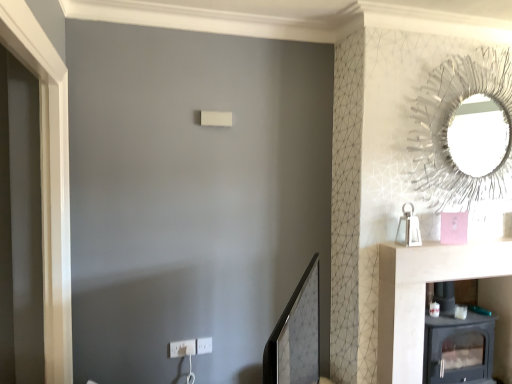
You are a GUI agent. You are given a task and a screenshot of the screen. Output one action in this format:
    pyautogui.click(x=<x>, y=<y>)
    Task: Click on the black matte wood stove at lower right
    The width and height of the screenshot is (512, 384).
    Given the screenshot: What is the action you would take?
    pyautogui.click(x=423, y=295)

Where is `white plastic electric outlet at lower center, marked as the first electric outlet in a left-to-right arrangement`? This screenshot has width=512, height=384. white plastic electric outlet at lower center, marked as the first electric outlet in a left-to-right arrangement is located at coordinates point(182,348).

Based on the photo, which of these two, metallic wire at upper right, positioned as the 2th mirror in bottom-to-top order, or black matte wood stove at lower right, is thinner?

metallic wire at upper right, positioned as the 2th mirror in bottom-to-top order.

Consider the image. Does metallic wire at upper right, which appears as the 1th mirror when viewed from the back, have a lesser height compared to black matte wood stove at lower right?

Incorrect, the height of metallic wire at upper right, which appears as the 1th mirror when viewed from the back, does not fall short of that of black matte wood stove at lower right.

Are metallic wire at upper right, placed as the second mirror when sorted from front to back, and black matte wood stove at lower right making contact?

metallic wire at upper right, placed as the second mirror when sorted from front to back, and black matte wood stove at lower right are clearly separated.

Considering the sizes of white plastic electric outlet at lower center, marked as the first electric outlet in a left-to-right arrangement, and black matte wood stove at lower right in the image, is white plastic electric outlet at lower center, marked as the first electric outlet in a left-to-right arrangement, wider or thinner than black matte wood stove at lower right?

Considering their sizes, white plastic electric outlet at lower center, marked as the first electric outlet in a left-to-right arrangement, looks slimmer than black matte wood stove at lower right.

Is white plastic electric outlet at lower center, marked as the first electric outlet in a left-to-right arrangement, beside black matte wood stove at lower right?

No, white plastic electric outlet at lower center, marked as the first electric outlet in a left-to-right arrangement, is not making contact with black matte wood stove at lower right.

From a real-world perspective, which object stands above the other?

From a 3D spatial view, white plastic electric outlet at lower center, which is counted as the 2th electric outlet, starting from the right, is above.

How different are the orientations of white plastic electric outlet at lower center, marked as the first electric outlet in a left-to-right arrangement, and black matte wood stove at lower right in degrees?

They differ by 0.128 degrees in their facing directions.

Starting from the white plastic electric outlet at lower center, marked as the first electric outlet in a left-to-right arrangement, which mirror is the 1st one to the right? Please provide its 2D coordinates.

[(296, 335)]

Could you tell me if white plastic electric outlet at lower center, which is counted as the 2th electric outlet, starting from the right, is facing matte black mirror at center, the second mirror viewed from the right?

Yes, white plastic electric outlet at lower center, which is counted as the 2th electric outlet, starting from the right, faces towards matte black mirror at center, the second mirror viewed from the right.

Between white plastic electric outlet at lower center, which is counted as the 2th electric outlet, starting from the right, and matte black mirror at center, the 2th mirror viewed from the back, which one has larger size?

Bigger between the two is matte black mirror at center, the 2th mirror viewed from the back.

Between white plastic electric outlet at lower center, marked as the first electric outlet in a left-to-right arrangement, and matte black mirror at center, the 2th mirror viewed from the back, which one has less height?

white plastic electric outlet at lower center, marked as the first electric outlet in a left-to-right arrangement, is shorter.

Is white plastic electric outlet at lower center, acting as the 2th electric outlet starting from the left, at the left side of metallic wire at upper right, the 1th mirror in the right-to-left sequence?

Yes.

Identify the location of the 2nd mirror to the right of the white plastic electric outlet at lower center, acting as the 2th electric outlet starting from the left, counting from the anchor's position. (464, 130).

Between white plastic electric outlet at lower center, which is the 1th electric outlet in right-to-left order, and metallic wire at upper right, the 1th mirror in the right-to-left sequence, which one has more height?

metallic wire at upper right, the 1th mirror in the right-to-left sequence.

Is point (269, 381) closer or farther from the camera than point (487, 259)?

Clearly, point (269, 381) is closer to the camera than point (487, 259).

Which object is positioned more to the right, matte black mirror at center, the 2th mirror viewed from the back, or black matte wood stove at lower right?

From the viewer's perspective, black matte wood stove at lower right appears more on the right side.

From the image's perspective, is matte black mirror at center, which ranks as the 2th mirror in top-to-bottom order, beneath black matte wood stove at lower right?

No, from the image's perspective, matte black mirror at center, which ranks as the 2th mirror in top-to-bottom order, is not below black matte wood stove at lower right.

In the scene shown: Considering the positions of objects matte black mirror at center, the second mirror viewed from the right, and metallic wire at upper right, positioned as the 2th mirror in bottom-to-top order, in the image provided, who is behind, matte black mirror at center, the second mirror viewed from the right, or metallic wire at upper right, positioned as the 2th mirror in bottom-to-top order,?

metallic wire at upper right, positioned as the 2th mirror in bottom-to-top order, is further away from the camera.

From the image's perspective, is matte black mirror at center, the 1th mirror positioned from the left, positioned above or below metallic wire at upper right, positioned as the 2th mirror in bottom-to-top order?

From the image's perspective, matte black mirror at center, the 1th mirror positioned from the left, appears below metallic wire at upper right, positioned as the 2th mirror in bottom-to-top order.

In terms of width, does matte black mirror at center, the second mirror viewed from the right, look wider or thinner when compared to metallic wire at upper right, which appears as the 1th mirror when viewed from the back?

In the image, matte black mirror at center, the second mirror viewed from the right, appears to be wider than metallic wire at upper right, which appears as the 1th mirror when viewed from the back.

Does matte black mirror at center, which ranks as the 2th mirror in top-to-bottom order, have a lesser height compared to metallic wire at upper right, which appears as the 1th mirror when viewed from the back?

Correct, matte black mirror at center, which ranks as the 2th mirror in top-to-bottom order, is not as tall as metallic wire at upper right, which appears as the 1th mirror when viewed from the back.

From a real-world perspective, does black matte wood stove at lower right sit lower than metallic wire at upper right, acting as the 1th mirror starting from the top?

Indeed, from a real-world perspective, black matte wood stove at lower right is positioned beneath metallic wire at upper right, acting as the 1th mirror starting from the top.

Is black matte wood stove at lower right wider or thinner than metallic wire at upper right, placed as the second mirror when sorted from front to back?

Considering their sizes, black matte wood stove at lower right looks broader than metallic wire at upper right, placed as the second mirror when sorted from front to back.

Is point (392, 352) closer or farther from the camera than point (483, 82)?

Point (392, 352) appears to be closer to the viewer than point (483, 82).

Between black matte wood stove at lower right and metallic wire at upper right, the 2th mirror when ordered from left to right, which one has less height?

Standing shorter between the two is black matte wood stove at lower right.

This screenshot has width=512, height=384. In order to click on the 2nd mirror positioned above the black matte wood stove at lower right (from the image's perspective) in this screenshot , I will do `click(464, 130)`.

Find the location of `the 2nd electric outlet in front of the black matte wood stove at lower right, starting your count from the anchor`. the 2nd electric outlet in front of the black matte wood stove at lower right, starting your count from the anchor is located at coordinates (182, 348).

From the image, which object appears to be nearer to matte black mirror at center, marked as the first mirror in a front-to-back arrangement, metallic wire at upper right, the 1th mirror in the right-to-left sequence, or black matte wood stove at lower right?

Based on the image, black matte wood stove at lower right appears to be nearer to matte black mirror at center, marked as the first mirror in a front-to-back arrangement.

Based on their spatial positions, is matte black mirror at center, the 1th mirror positioned from the left, or metallic wire at upper right, the 1th mirror in the right-to-left sequence, closer to black matte wood stove at lower right?

Among the two, metallic wire at upper right, the 1th mirror in the right-to-left sequence, is located nearer to black matte wood stove at lower right.

From the image, which object appears to be farther from black matte wood stove at lower right, white plastic electric outlet at lower center, which is the 1th electric outlet in right-to-left order, or metallic wire at upper right, acting as the 1th mirror starting from the top?

white plastic electric outlet at lower center, which is the 1th electric outlet in right-to-left order.

From the image, which object appears to be farther from white plastic electric outlet at lower center, which is the 1th electric outlet in right-to-left order, matte black mirror at center, the 2th mirror viewed from the back, or metallic wire at upper right, placed as the second mirror when sorted from front to back?

metallic wire at upper right, placed as the second mirror when sorted from front to back.

Based on their spatial positions, is black matte wood stove at lower right or white plastic electric outlet at lower center, marked as the first electric outlet in a left-to-right arrangement, further from matte black mirror at center, the 1th mirror positioned from the left?

The object further to matte black mirror at center, the 1th mirror positioned from the left, is white plastic electric outlet at lower center, marked as the first electric outlet in a left-to-right arrangement.

Estimate the real-world distances between objects in this image. Which object is further from white plastic electric outlet at lower center, acting as the 2th electric outlet starting from the left, black matte wood stove at lower right or matte black mirror at center, marked as the first mirror in a front-to-back arrangement?

black matte wood stove at lower right.

When comparing their distances from black matte wood stove at lower right, does metallic wire at upper right, positioned as the 2th mirror in bottom-to-top order, or matte black mirror at center, positioned as the 1th mirror in bottom-to-top order, seem closer?

metallic wire at upper right, positioned as the 2th mirror in bottom-to-top order, is closer to black matte wood stove at lower right.

From the image, which object appears to be nearer to matte black mirror at center, positioned as the 1th mirror in bottom-to-top order, metallic wire at upper right, which appears as the 1th mirror when viewed from the back, or white plastic electric outlet at lower center, marked as the first electric outlet in a left-to-right arrangement?

Among the two, white plastic electric outlet at lower center, marked as the first electric outlet in a left-to-right arrangement, is located nearer to matte black mirror at center, positioned as the 1th mirror in bottom-to-top order.

This screenshot has height=384, width=512. In order to click on mirror situated between white plastic electric outlet at lower center, which is the 1th electric outlet in right-to-left order, and metallic wire at upper right, acting as the 1th mirror starting from the top, from left to right in this screenshot , I will do `click(296, 335)`.

At what (x,y) coordinates should I click in order to perform the action: click on electric outlet between white plastic electric outlet at lower center, which is counted as the 2th electric outlet, starting from the right, and black matte wood stove at lower right. Please return your answer as a coordinate pair (x, y). Image resolution: width=512 pixels, height=384 pixels. Looking at the image, I should click on (204, 345).

This screenshot has width=512, height=384. I want to click on electric outlet between matte black mirror at center, marked as the first mirror in a front-to-back arrangement, and white plastic electric outlet at lower center, acting as the 2th electric outlet starting from the left, along the z-axis, so click(x=182, y=348).

You are a GUI agent. You are given a task and a screenshot of the screen. Output one action in this format:
    pyautogui.click(x=<x>, y=<y>)
    Task: Click on the mirror between white plastic electric outlet at lower center, which is counted as the 2th electric outlet, starting from the right, and metallic wire at upper right, acting as the 1th mirror starting from the top
    
    Given the screenshot: What is the action you would take?
    pyautogui.click(x=296, y=335)